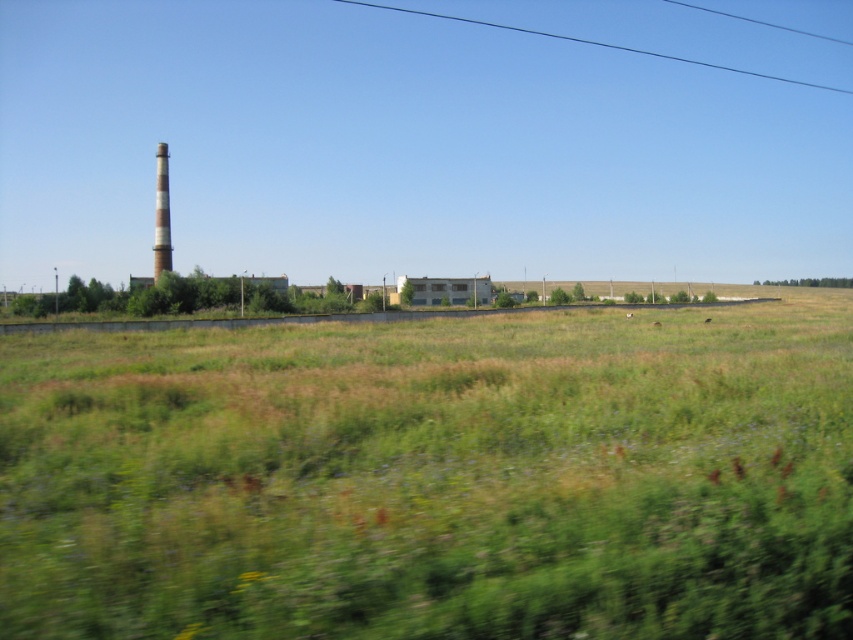
You are driving along a road and notice two objects in the distance. You see the black wire at upper center and the white striped chimney at left. Which object is closer to you?

The black wire at upper center is closer to you because it appears in front of the white striped chimney at left.

From the picture: You are standing at point A and want to reach the tall cylindrical chimney on the left of the industrial buildings. The point you are currently at is marked as point (434,477). Is the path from your current position to the chimney going through the green grassy field at center?

Yes, the path from point (434,477) to the tall cylindrical chimney on the left of the industrial buildings would go through the green grassy field at center because the point is located on that field.